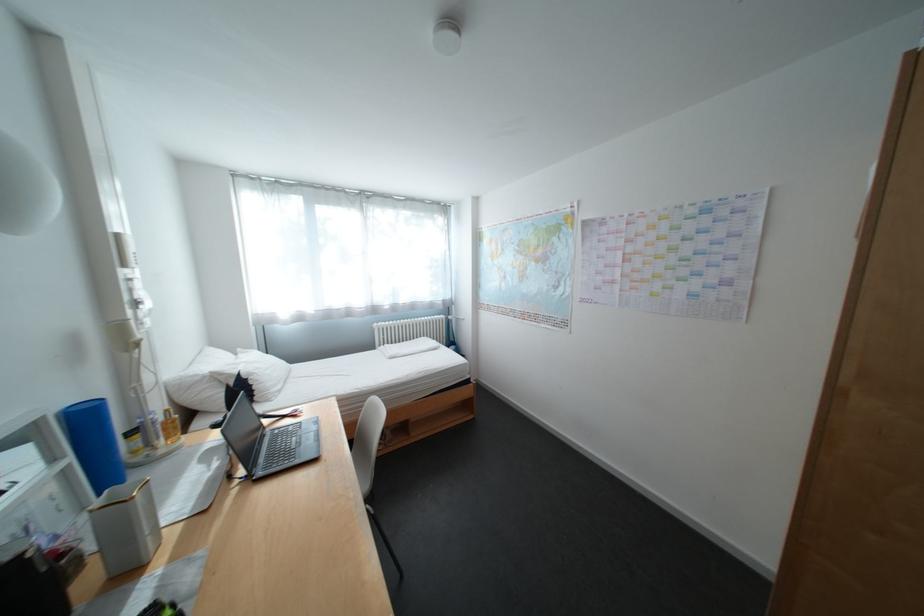
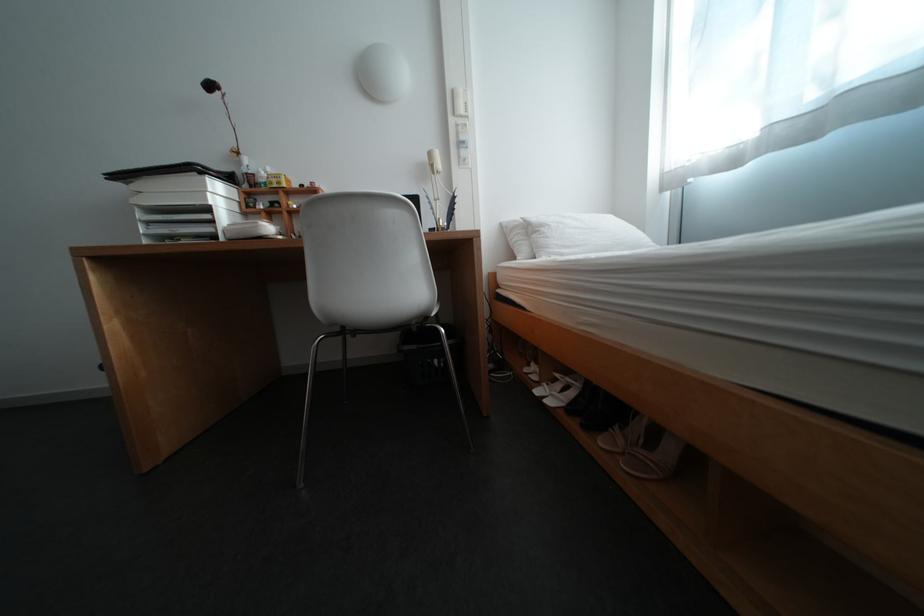
The point at (264,376) is marked in the first image. Where is the corresponding point in the second image?

(555, 228)